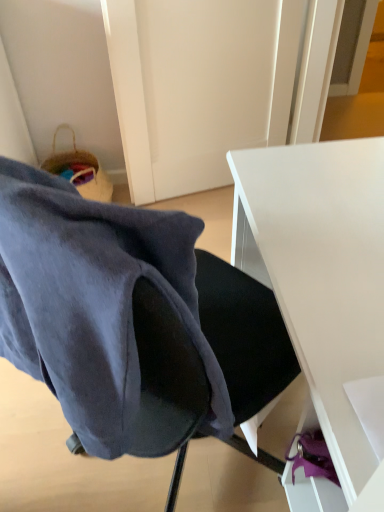
The height and width of the screenshot is (512, 384). What do you see at coordinates (321, 290) in the screenshot?
I see `white matte desk at center` at bounding box center [321, 290].

The height and width of the screenshot is (512, 384). I want to click on white matte desk at center, so click(x=321, y=290).

Describe the element at coordinates (106, 298) in the screenshot. The image size is (384, 512). I see `velvet dark blue chair at center` at that location.

Image resolution: width=384 pixels, height=512 pixels. What are the coordinates of `velvet dark blue chair at center` in the screenshot? It's located at (106, 298).

You are a GUI agent. You are given a task and a screenshot of the screen. Output one action in this format:
    pyautogui.click(x=<x>, y=<y>)
    Task: Click on the white matte desk at center
    The image size is (384, 512).
    Given the screenshot: What is the action you would take?
    pyautogui.click(x=321, y=290)

Does white matte desk at center appear on the right side of velvet dark blue chair at center?

Yes.

Considering the positions of objects white matte desk at center and velvet dark blue chair at center in the image provided, who is in front, white matte desk at center or velvet dark blue chair at center?

velvet dark blue chair at center is closer to the camera.

Does point (342, 207) appear closer or farther from the camera than point (196, 230)?

Clearly, point (342, 207) is more distant from the camera than point (196, 230).

From the image's perspective, is white matte desk at center above velvet dark blue chair at center?

No.

From a real-world perspective, is white matte desk at center physically above velvet dark blue chair at center?

No, from a real-world perspective, white matte desk at center is not over velvet dark blue chair at center

Is white matte desk at center thinner than velvet dark blue chair at center?

No.

In terms of height, does white matte desk at center look taller or shorter compared to velvet dark blue chair at center?

Considering their sizes, white matte desk at center has more height than velvet dark blue chair at center.

Who is bigger, white matte desk at center or velvet dark blue chair at center?

white matte desk at center.

Is white matte desk at center located outside velvet dark blue chair at center?

Yes, white matte desk at center is not within velvet dark blue chair at center.

Is the surface of white matte desk at center in direct contact with velvet dark blue chair at center?

No, white matte desk at center is not next to velvet dark blue chair at center.

Is white matte desk at center looking in the opposite direction of velvet dark blue chair at center?

No, velvet dark blue chair at center is not at the back of white matte desk at center.

The height and width of the screenshot is (512, 384). I want to click on chair above the white matte desk at center (from a real-world perspective), so click(x=106, y=298).

Considering the positions of objects velvet dark blue chair at center and white matte desk at center in the image provided, who is more to the right, velvet dark blue chair at center or white matte desk at center?

white matte desk at center is more to the right.

Based on the photo, which object is closer to the camera, velvet dark blue chair at center or white matte desk at center?

velvet dark blue chair at center is more forward.

Considering the positions of point (96, 338) and point (300, 301), is point (96, 338) closer or farther from the camera than point (300, 301)?

Point (96, 338).

From the image's perspective, which object appears higher, velvet dark blue chair at center or white matte desk at center?

velvet dark blue chair at center, from the image's perspective.

From a real-world perspective, does velvet dark blue chair at center stand above white matte desk at center?

Correct, in the physical world, velvet dark blue chair at center is higher than white matte desk at center.

In terms of width, does velvet dark blue chair at center look wider or thinner when compared to white matte desk at center?

Considering their sizes, velvet dark blue chair at center looks slimmer than white matte desk at center.

Does velvet dark blue chair at center have a greater height compared to white matte desk at center?

In fact, velvet dark blue chair at center may be shorter than white matte desk at center.

In terms of size, does velvet dark blue chair at center appear bigger or smaller than white matte desk at center?

Considering their sizes, velvet dark blue chair at center takes up less space than white matte desk at center.

Is velvet dark blue chair at center situated inside white matte desk at center or outside?

The correct answer is: outside.

Are velvet dark blue chair at center and white matte desk at center located far from each other?

They are positioned close to each other.

Is velvet dark blue chair at center facing away from white matte desk at center?

No, velvet dark blue chair at center's orientation is not away from white matte desk at center.

I want to click on desk behind the velvet dark blue chair at center, so click(321, 290).

Locate an element on the screen. desk below the velvet dark blue chair at center (from the image's perspective) is located at coordinates (321, 290).

Find the location of a particular element. desk that is under the velvet dark blue chair at center (from a real-world perspective) is located at coordinates (321, 290).